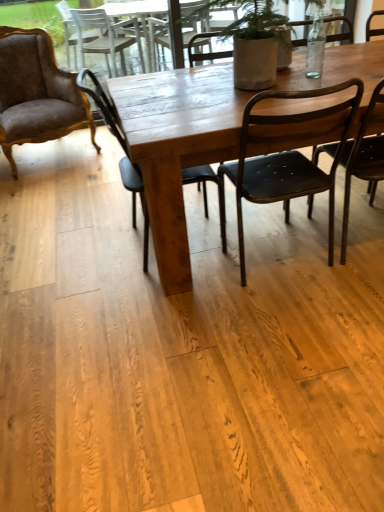
Where is `vacant space that is to the left of wooden table at center`? vacant space that is to the left of wooden table at center is located at coordinates click(74, 263).